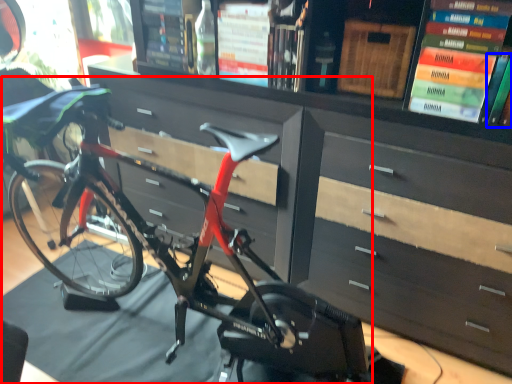
Question: Among these objects, which one is nearest to the camera, bicycle (highlighted by a red box) or book (highlighted by a blue box)?

Choices:
 (A) bicycle
 (B) book

Answer: (A)